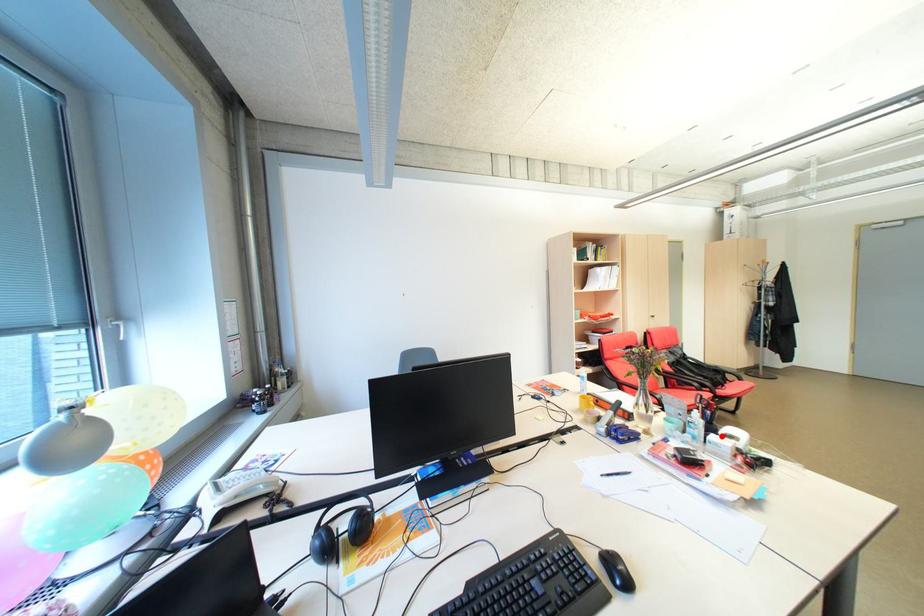
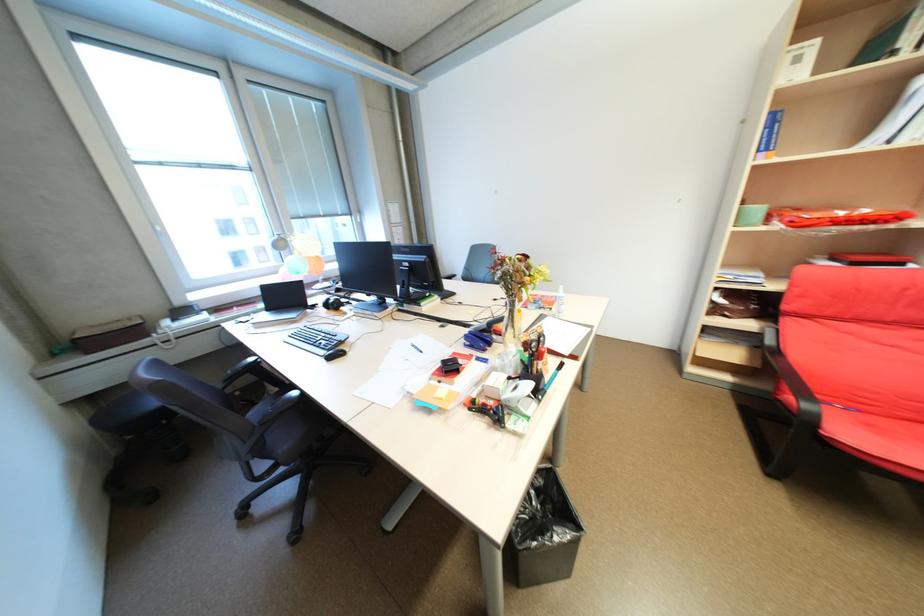
Question: I am providing you with two images of the same scene from different viewpoints. A red point is marked on the first image. Is the red point's position out of view in image 2?

Choices:
 (A) Yes
 (B) No

Answer: (A)